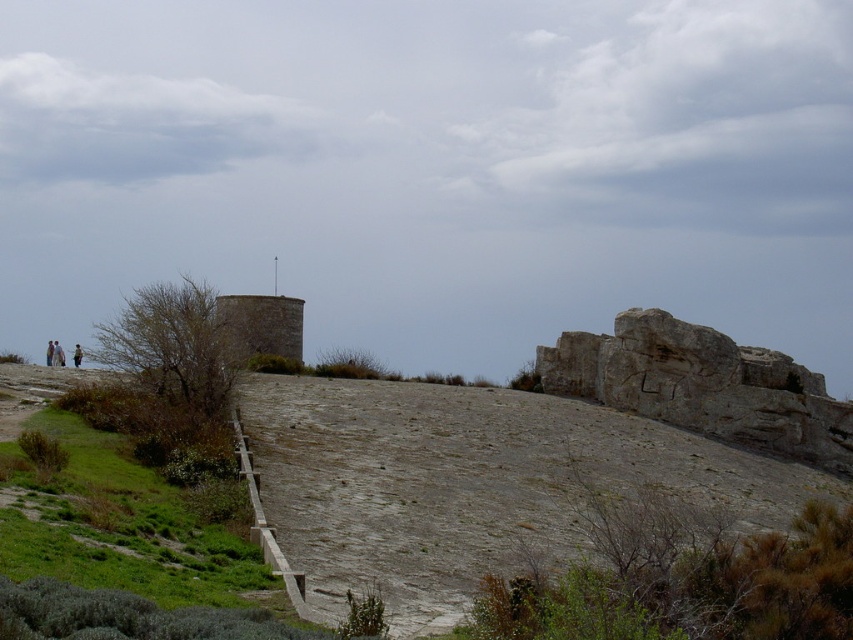
Question: Where is gray rocky hillside at center located in relation to green grassy at lower left in the image?

Choices:
 (A) above
 (B) below

Answer: (B)

Question: Does gray rocky hillside at center have a smaller size compared to green grassy at lower left?

Choices:
 (A) yes
 (B) no

Answer: (B)

Question: Is gray rocky hillside at center smaller than green grassy at lower left?

Choices:
 (A) yes
 (B) no

Answer: (B)

Question: Among these objects, which one is farthest from the camera?

Choices:
 (A) gray rocky hillside at center
 (B) green grassy at lower left

Answer: (A)

Question: Which object appears farthest from the camera in this image?

Choices:
 (A) gray rocky hillside at center
 (B) green grassy at lower left

Answer: (A)